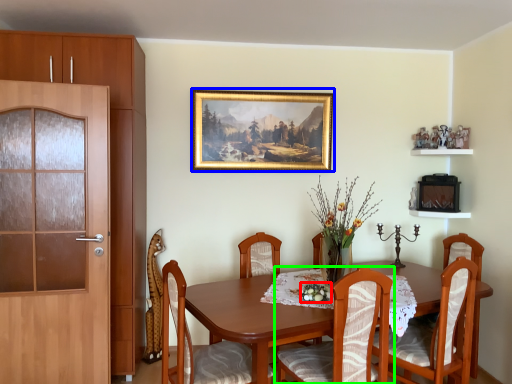
Question: Which object is positioned farthest from floral arrangement (highlighted by a red box)? Select from picture frame (highlighted by a blue box) and chair (highlighted by a green box).

Choices:
 (A) picture frame
 (B) chair

Answer: (A)